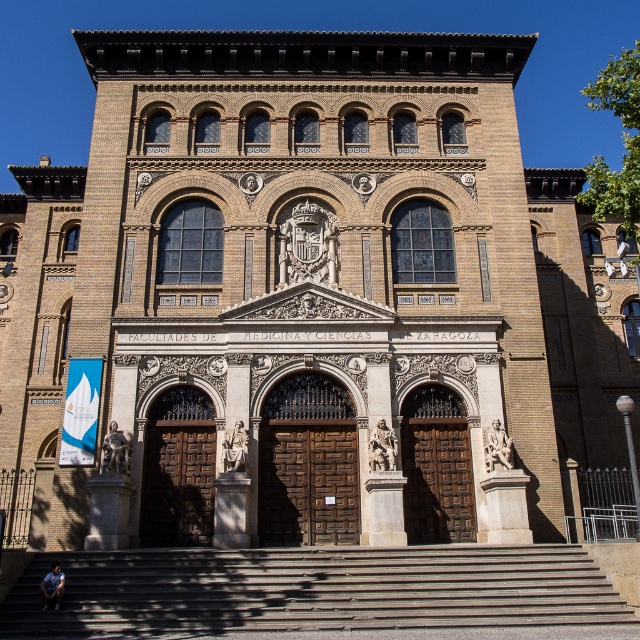
Question: Is brown wooden stairs at center further to the viewer compared to wooden door at center?

Choices:
 (A) yes
 (B) no

Answer: (B)

Question: Can you confirm if brown wooden stairs at center is positioned to the left of wooden door at center?

Choices:
 (A) no
 (B) yes

Answer: (A)

Question: Considering the real-world distances, which object is closest to the brown wooden stairs at center?

Choices:
 (A) marble statue at right
 (B) wooden door at center
 (C) bronze statue at center
 (D) blue denim jeans at lower left

Answer: (D)

Question: Which point is farther to the camera?

Choices:
 (A) polished bronze statue at center
 (B) wooden door at center
 (C) bronze statue at center

Answer: (B)

Question: Which point is farther to the camera?

Choices:
 (A) stone statue at center
 (B) polished bronze statue at center

Answer: (B)

Question: Can you confirm if bronze statue at center is positioned to the left of blue denim jeans at lower left?

Choices:
 (A) no
 (B) yes

Answer: (A)